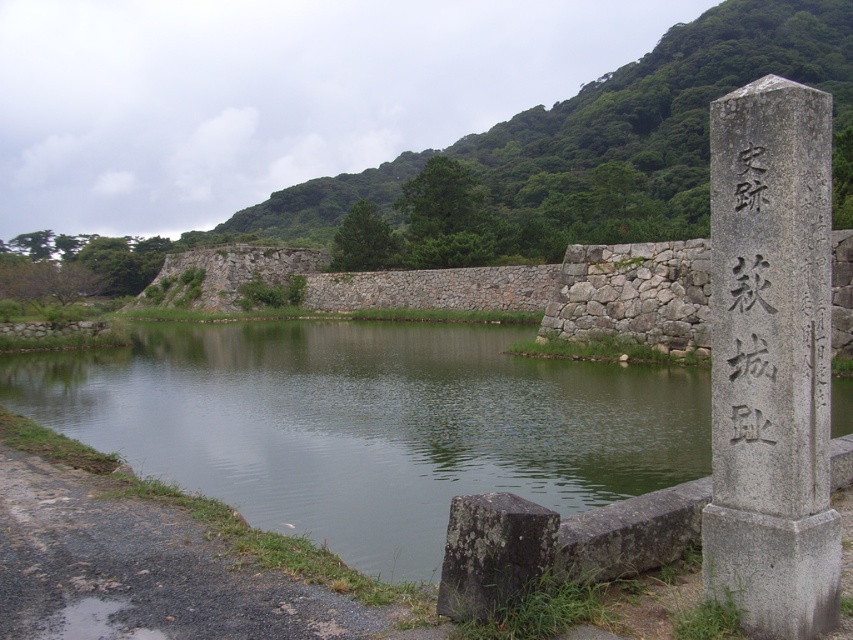
Which is below, green stone river at center or black stone writing at right?

green stone river at center is lower down.

Can you confirm if green stone river at center is thinner than black stone writing at right?

In fact, green stone river at center might be wider than black stone writing at right.

Who is more forward, (223, 481) or (757, 285)?

Point (757, 285)

At what (x,y) coordinates should I click in order to perform the action: click on green stone river at center. Please return your answer as a coordinate pair (x, y). The image size is (853, 640). Looking at the image, I should click on (369, 424).

Does gray stone pillar at right have a lesser height compared to black stone writing at right?

Incorrect, gray stone pillar at right's height does not fall short of black stone writing at right's.

Which is more to the left, gray stone pillar at right or black stone writing at right?

From the viewer's perspective, black stone writing at right appears more on the left side.

This screenshot has height=640, width=853. What do you see at coordinates (770, 362) in the screenshot?
I see `gray stone pillar at right` at bounding box center [770, 362].

I want to click on gray stone pillar at right, so click(770, 362).

Is green stone river at center thinner than gray stone pillar at right?

No, green stone river at center is not thinner than gray stone pillar at right.

What do you see at coordinates (369, 424) in the screenshot?
I see `green stone river at center` at bounding box center [369, 424].

This screenshot has width=853, height=640. I want to click on green stone river at center, so click(x=369, y=424).